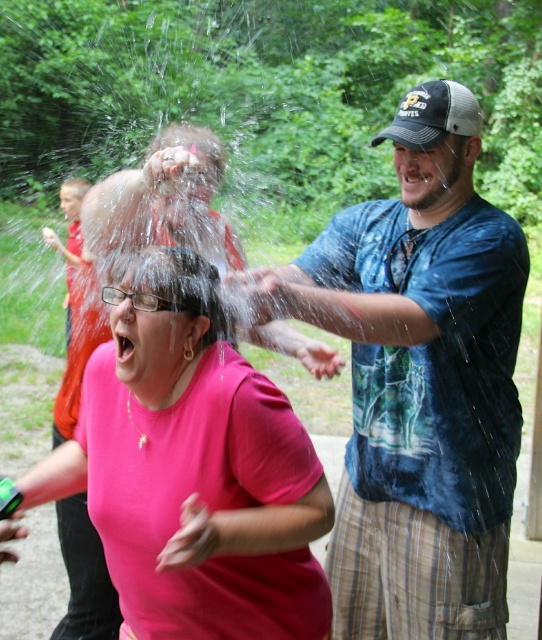
Who is shorter, blue tie-dye shirt at center or black mesh baseball cap at upper right?

With less height is black mesh baseball cap at upper right.

Find the location of a particular element. blue tie-dye shirt at center is located at coordinates (416, 380).

Does point (461, 330) come in front of point (446, 81)?

Yes.

You are a GUI agent. You are given a task and a screenshot of the screen. Output one action in this format:
    pyautogui.click(x=<x>, y=<y>)
    Task: Click on the blue tie-dye shirt at center
    
    Given the screenshot: What is the action you would take?
    416,380

Does black mesh baseball cap at upper right have a lesser height compared to red shirt at left?

Yes.

Can you confirm if black mesh baseball cap at upper right is smaller than red shirt at left?

Correct, black mesh baseball cap at upper right occupies less space than red shirt at left.

Who is more forward, [435,113] or [56,244]?

Point [435,113] is more forward.

Locate an element on the screen. The height and width of the screenshot is (640, 542). black mesh baseball cap at upper right is located at coordinates (433, 115).

Does pink matte shirt at center have a greater width compared to red shirt at left?

Correct, the width of pink matte shirt at center exceeds that of red shirt at left.

In the scene shown: Is pink matte shirt at center smaller than red shirt at left?

Actually, pink matte shirt at center might be larger than red shirt at left.

This screenshot has height=640, width=542. I want to click on pink matte shirt at center, so click(x=196, y=468).